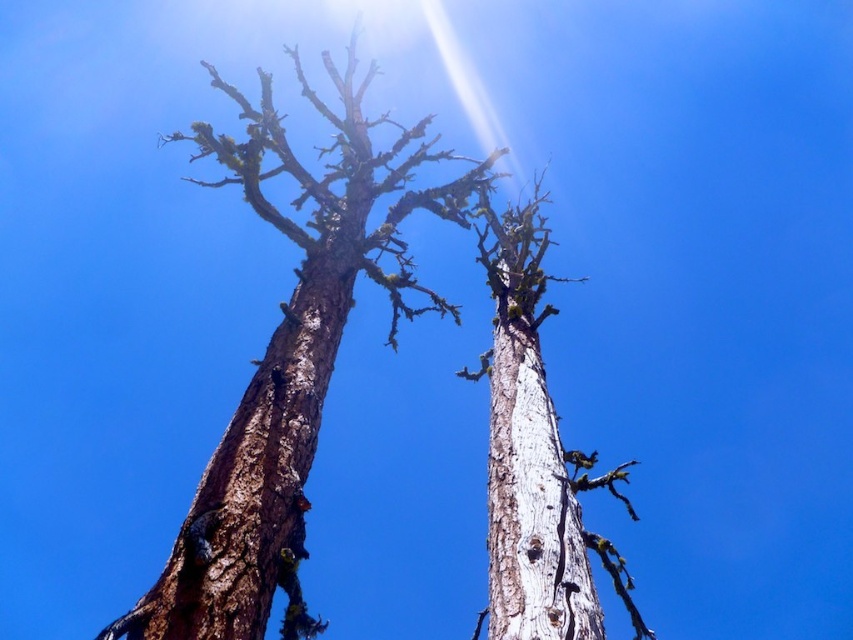
You are an arborist examining two trees in the scene. You notice that the brown rough bark tree at center and the brown rough bark tree trunk at center are positioned in a specific way. Which of these two trees is located to the left of the other?

The brown rough bark tree at center is positioned on the left side of the brown rough bark tree trunk at center.

You are standing at the center of the image and want to locate the brown rough bark tree at center. Which direction should you look to find it?

The brown rough bark tree at center is located at the center of the image, so you should look straight ahead to find it.

You are an artist sketching the two trees in the image. You want to draw the brown rough bark tree at center first. Which direction should you look to find it relative to the white rough bark tree trunk at center?

The brown rough bark tree at center is positioned on the left side of the white rough bark tree trunk at center. So, you should look to the left of the white rough bark tree trunk at center to find the brown rough bark tree at center.